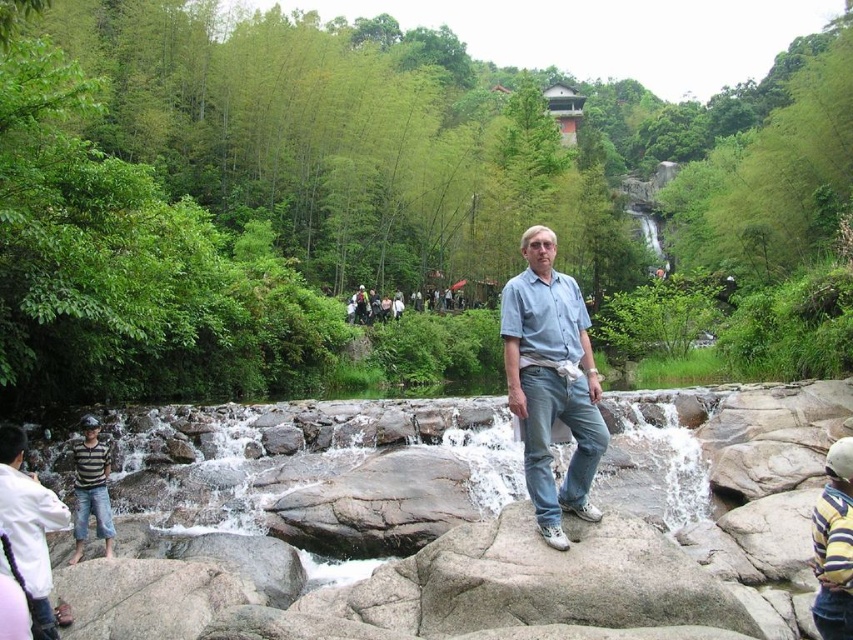
Can you confirm if light blue denim jeans at center is positioned to the right of white shirt at lower left?

Yes, light blue denim jeans at center is to the right of white shirt at lower left.

In the scene shown: Is light blue denim jeans at center further to the viewer compared to white shirt at lower left?

Yes.

What do you see at coordinates (550, 381) in the screenshot? I see `light blue denim jeans at center` at bounding box center [550, 381].

Image resolution: width=853 pixels, height=640 pixels. Identify the location of light blue denim jeans at center. (550, 381).